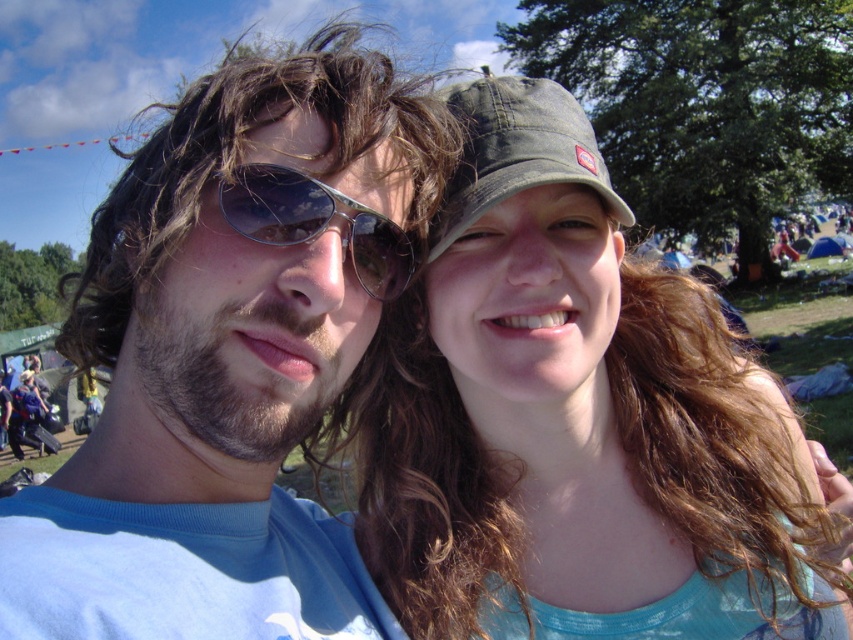
Question: Which point appears farthest from the camera in this image?

Choices:
 (A) (558, 460)
 (B) (467, 113)
 (C) (366, 586)
 (D) (373, 285)

Answer: (A)

Question: Which object appears farthest from the camera in this image?

Choices:
 (A) sunglasses at center
 (B) matte blue shirt at center

Answer: (A)

Question: Is matte green cap at upper right below sunglasses at center?

Choices:
 (A) yes
 (B) no

Answer: (A)

Question: Is green matte baseball cap at upper right positioned in front of sunglasses at center?

Choices:
 (A) yes
 (B) no

Answer: (B)

Question: Is matte blue shirt at center to the right of green matte baseball cap at upper right from the viewer's perspective?

Choices:
 (A) yes
 (B) no

Answer: (B)

Question: Which object is closer to the camera taking this photo?

Choices:
 (A) matte blue shirt at center
 (B) green matte baseball cap at upper right

Answer: (A)